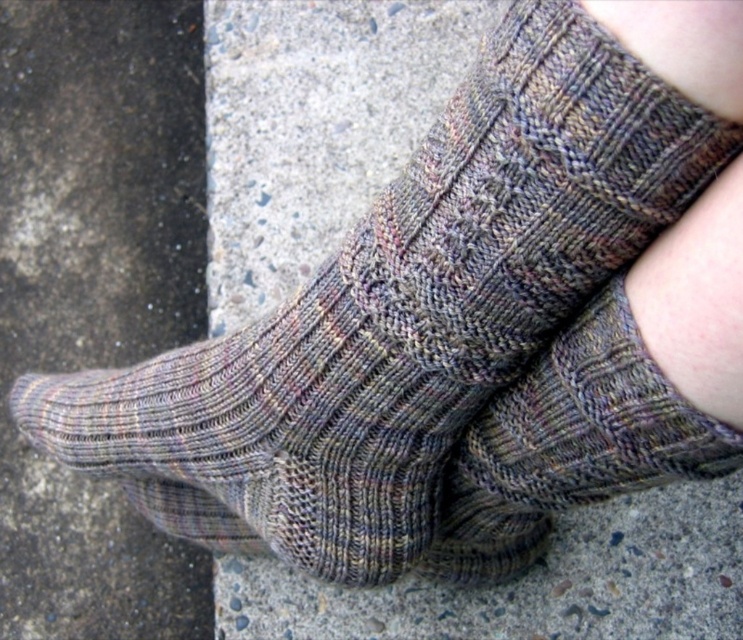
Can you confirm if gray concrete at lower left is smaller than multicolored knitted sock at center?

Incorrect, gray concrete at lower left is not smaller in size than multicolored knitted sock at center.

Does gray concrete at lower left come behind multicolored knitted sock at center?

Yes, gray concrete at lower left is behind multicolored knitted sock at center.

Is point (149, 3) closer to viewer compared to point (584, 326)?

No, (149, 3) is further to viewer.

This screenshot has width=743, height=640. What are the coordinates of `gray concrete at lower left` in the screenshot? It's located at (97, 292).